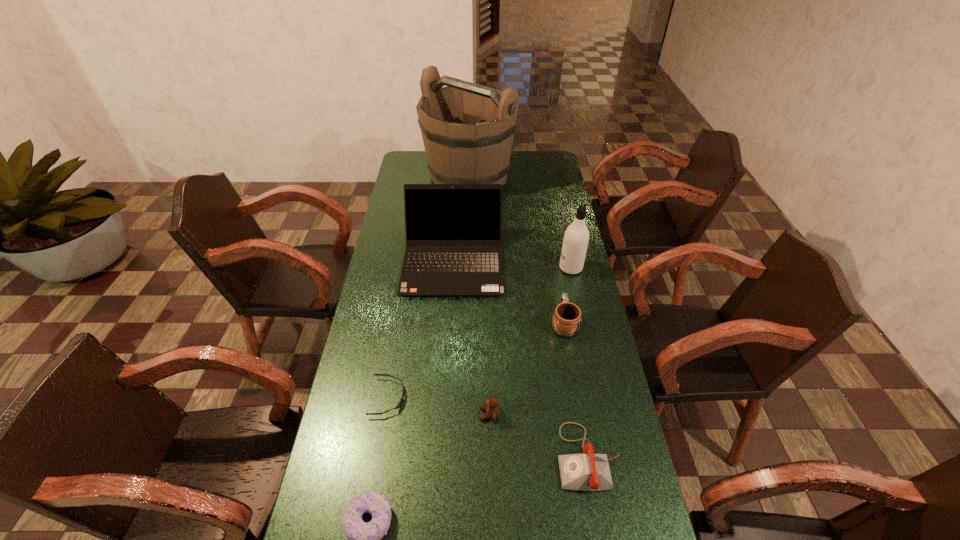
Identify the location of free location located 0.130m on the front-facing side of the second tallest object. The height and width of the screenshot is (540, 960). (526, 268).

At what (x,y) coordinates should I click in order to perform the action: click on free region located on the front-facing side of the second tallest object. Please return your answer as a coordinate pair (x, y). The image size is (960, 540). Looking at the image, I should click on (477, 268).

Locate an element on the screen. free space located on the screen of the third tallest object is located at coordinates (447, 350).

Locate an element on the screen. The width and height of the screenshot is (960, 540). free region located on the side of the mug with the handle is located at coordinates (553, 262).

Where is `free location located on the side of the mug with the handle`? free location located on the side of the mug with the handle is located at coordinates (551, 250).

Identify the location of vacant space situated 0.360m on the side of the mug with the handle. (550, 242).

Identify the location of free space located 0.140m at the face of the teddy bear. (431, 414).

Where is `vacant position located at the face of the teddy bear`? Image resolution: width=960 pixels, height=540 pixels. vacant position located at the face of the teddy bear is located at coordinates (348, 414).

In order to click on vacant space located at the face of the teddy bear in this screenshot , I will do `click(375, 414)`.

Where is `free space located on the dial of the third shortest object`? Image resolution: width=960 pixels, height=540 pixels. free space located on the dial of the third shortest object is located at coordinates (420, 457).